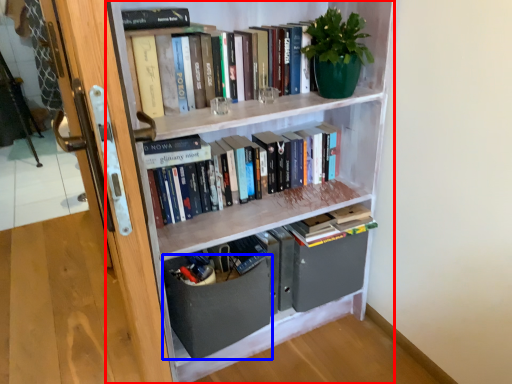
Question: Which object appears farthest to the camera in this image, bookcase (highlighted by a red box) or drawer (highlighted by a blue box)?

Choices:
 (A) bookcase
 (B) drawer

Answer: (B)